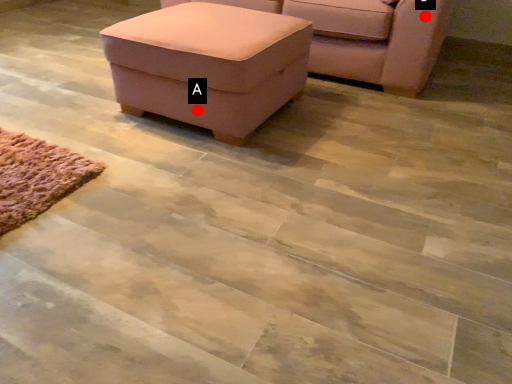
Question: Two points are circled on the image, labeled by A and B beside each circle. Among these points, which one is farthest from the camera?

Choices:
 (A) A is further
 (B) B is further

Answer: (B)